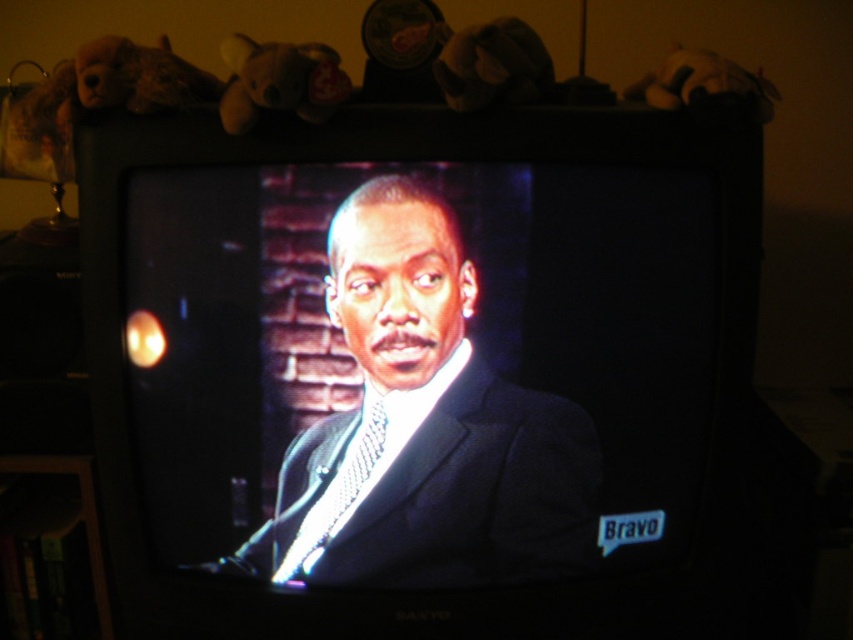
Question: From the image, what is the correct spatial relationship of matte black suit at center in relation to shiny silver tie at center?

Choices:
 (A) below
 (B) above

Answer: (B)

Question: Which point appears farthest from the camera in this image?

Choices:
 (A) (357, 477)
 (B) (459, 442)

Answer: (A)

Question: Which point is farther from the camera taking this photo?

Choices:
 (A) (355, 467)
 (B) (407, 401)

Answer: (A)

Question: Is matte black suit at center below shiny silver tie at center?

Choices:
 (A) yes
 (B) no

Answer: (B)

Question: Is matte black suit at center closer to the viewer compared to shiny silver tie at center?

Choices:
 (A) no
 (B) yes

Answer: (B)

Question: Which point is farther to the camera?

Choices:
 (A) (366, 440)
 (B) (271, 580)

Answer: (B)